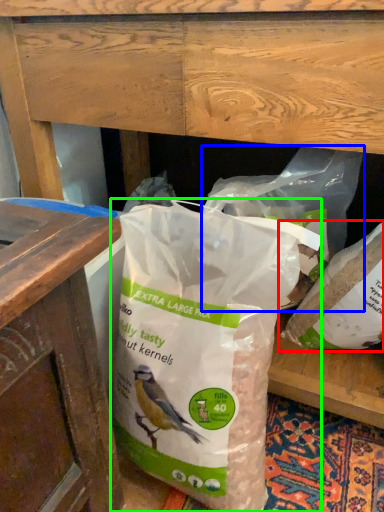
Question: Which object is positioned closest to plastic bag (highlighted by a red box)? Select from plastic bag (highlighted by a blue box) and plastic bag (highlighted by a green box).

Choices:
 (A) plastic bag
 (B) plastic bag

Answer: (A)